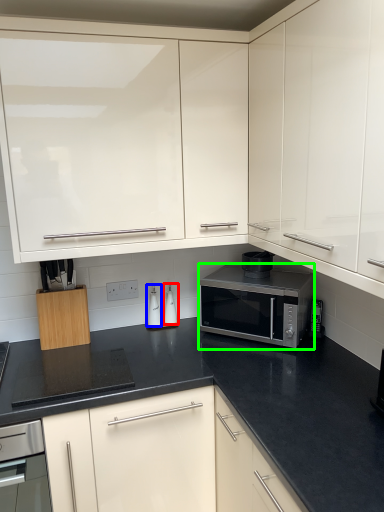
Question: Which object is the farthest from appliance (highlighted by a red box)? Choose among these: appliance (highlighted by a blue box) or microwave oven (highlighted by a green box).

Choices:
 (A) appliance
 (B) microwave oven

Answer: (B)